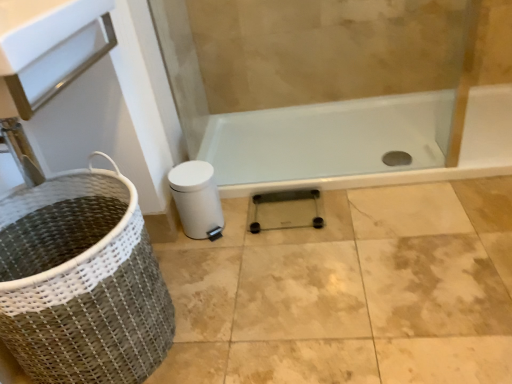
Where is `vacant area that lies to the right of transparent glass scale at center`? vacant area that lies to the right of transparent glass scale at center is located at coordinates (357, 221).